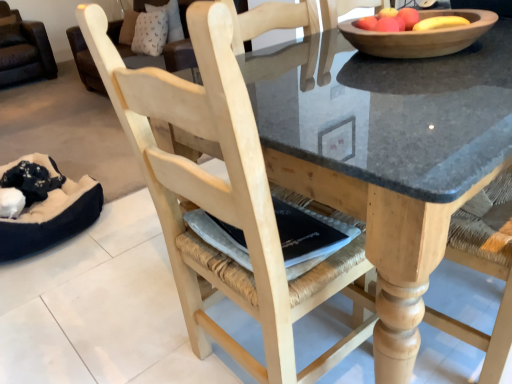
Question: Are wooden bowl at upper center and natural wood chair at center far apart?

Choices:
 (A) yes
 (B) no

Answer: (B)

Question: From a real-world perspective, does wooden bowl at upper center stand above natural wood chair at center?

Choices:
 (A) no
 (B) yes

Answer: (B)

Question: Can you confirm if wooden bowl at upper center is wider than natural wood chair at center?

Choices:
 (A) yes
 (B) no

Answer: (B)

Question: Is wooden bowl at upper center beside natural wood chair at center?

Choices:
 (A) no
 (B) yes

Answer: (A)

Question: From a real-world perspective, is wooden bowl at upper center under natural wood chair at center?

Choices:
 (A) no
 (B) yes

Answer: (A)

Question: Considering the positions of point (292, 104) and point (84, 198), is point (292, 104) closer or farther from the camera than point (84, 198)?

Choices:
 (A) closer
 (B) farther

Answer: (A)

Question: Relative to black plush bean bag at lower left, is natural wood table at center in front or behind?

Choices:
 (A) behind
 (B) front

Answer: (B)

Question: Would you say natural wood table at center is inside or outside black plush bean bag at lower left?

Choices:
 (A) outside
 (B) inside

Answer: (A)

Question: From a real-world perspective, relative to black plush bean bag at lower left, is natural wood table at center vertically above or below?

Choices:
 (A) above
 (B) below

Answer: (A)

Question: From a real-world perspective, is wooden bowl at upper center above or below black plush bean bag at lower left?

Choices:
 (A) below
 (B) above

Answer: (B)

Question: Considering the positions of point (456, 34) and point (29, 236), is point (456, 34) closer or farther from the camera than point (29, 236)?

Choices:
 (A) closer
 (B) farther

Answer: (A)

Question: Visually, is wooden bowl at upper center positioned to the left or to the right of black plush bean bag at lower left?

Choices:
 (A) right
 (B) left

Answer: (A)

Question: Looking at their shapes, would you say wooden bowl at upper center is wider or thinner than black plush bean bag at lower left?

Choices:
 (A) wide
 (B) thin

Answer: (B)

Question: From the image's perspective, is natural wood table at center located above or below natural wood chair at center?

Choices:
 (A) above
 (B) below

Answer: (A)

Question: Is natural wood table at center bigger or smaller than natural wood chair at center?

Choices:
 (A) big
 (B) small

Answer: (A)